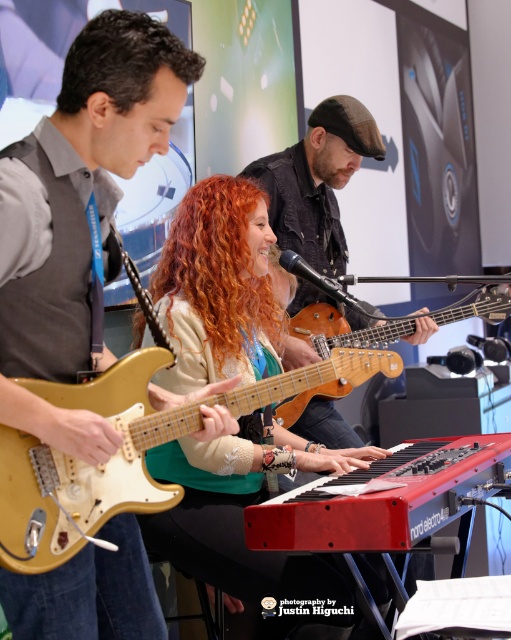
Question: Which object is closer to the camera taking this photo?

Choices:
 (A) gold wood guitar at center
 (B) dark brown curly hair at upper left
 (C) curly red hair at center

Answer: (A)

Question: Is matte gold guitar at center behind dark brown curly hair at upper left?

Choices:
 (A) no
 (B) yes

Answer: (B)

Question: Is matte gold guitar at left above curly red hair at center?

Choices:
 (A) no
 (B) yes

Answer: (B)

Question: Does curly red hair at center come behind dark brown curly hair at upper left?

Choices:
 (A) yes
 (B) no

Answer: (A)

Question: Which point is farther from the camera taking this photo?

Choices:
 (A) (201, 321)
 (B) (60, 100)

Answer: (A)

Question: Which is farther from the matte gold guitar at left?

Choices:
 (A) dark brown curly hair at upper left
 (B) gold wood guitar at center

Answer: (B)